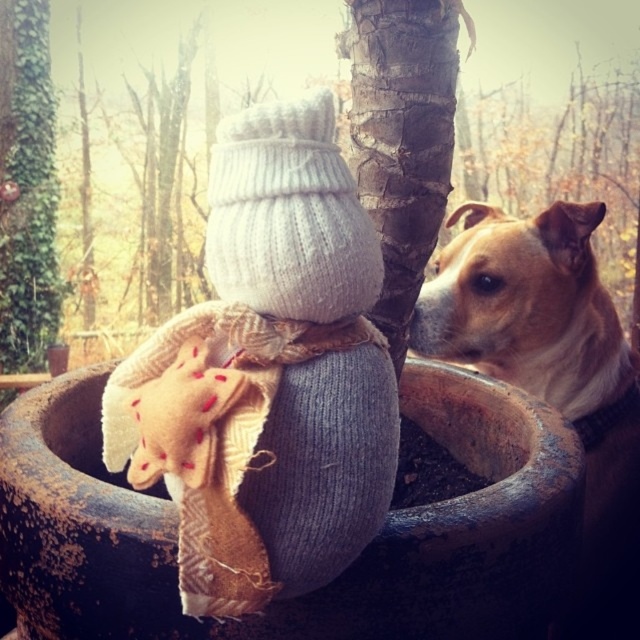
You are standing at the origin point of the coordinate system. You want to walk to the knitted woolen snowman at center. What direction should you walk in?

The knitted woolen snowman at center is located at coordinate point 0.586 on the x axis and 0.419 on the y axis. Since you are at the origin point, you should walk towards the positive x and positive y direction to reach it.

You are standing in front of the snowman and want to place two markers at coordinates point (x=625, y=360) and point (x=449, y=179). Which marker will be closer to your eyes?

Point (x=625, y=360) is further to the camera than point (x=449, y=179), so the marker at point (x=449, y=179) will be closer to your eyes.

You are planning to place a small decorative wreath on the knitted woolen snowman at center and the smooth bark tree trunk at center. Which object will allow the wreath to be more visible due to its size?

The knitted woolen snowman at center is bigger than the smooth bark tree trunk at center, so placing the wreath on the knitted woolen snowman at center will make it more visible because of its larger size.